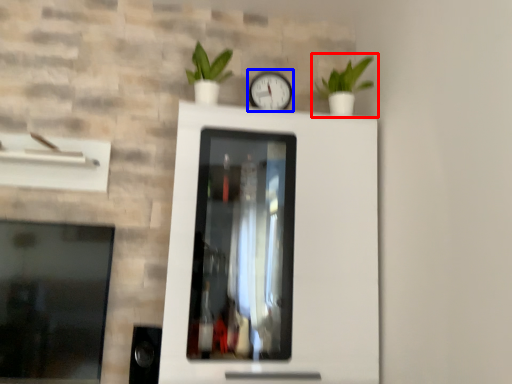
Question: Among these objects, which one is farthest to the camera, houseplant (highlighted by a red box) or clock (highlighted by a blue box)?

Choices:
 (A) houseplant
 (B) clock

Answer: (B)